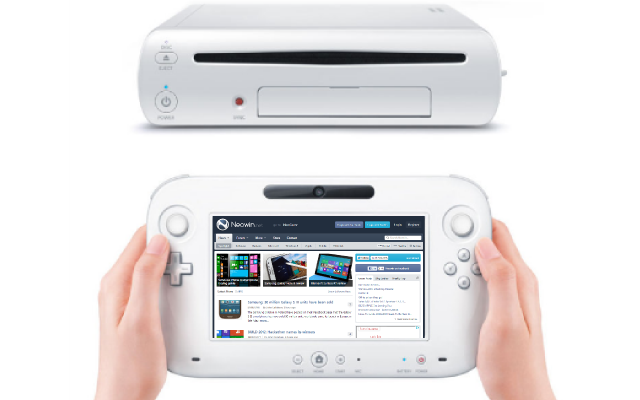
What are the coordinates of `panel` in the screenshot? It's located at (338, 100).